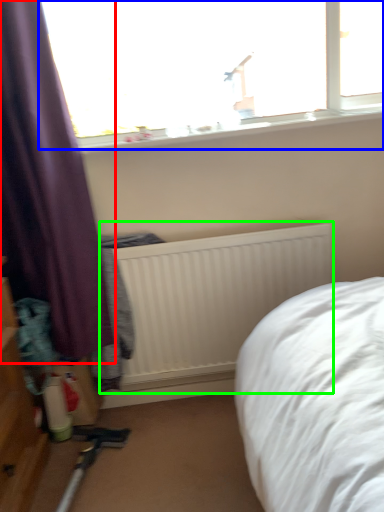
Question: Estimate the real-world distances between objects in this image. Which object is farther from curtain (highlighted by a red box), window (highlighted by a blue box) or radiator (highlighted by a green box)?

Choices:
 (A) window
 (B) radiator

Answer: (A)